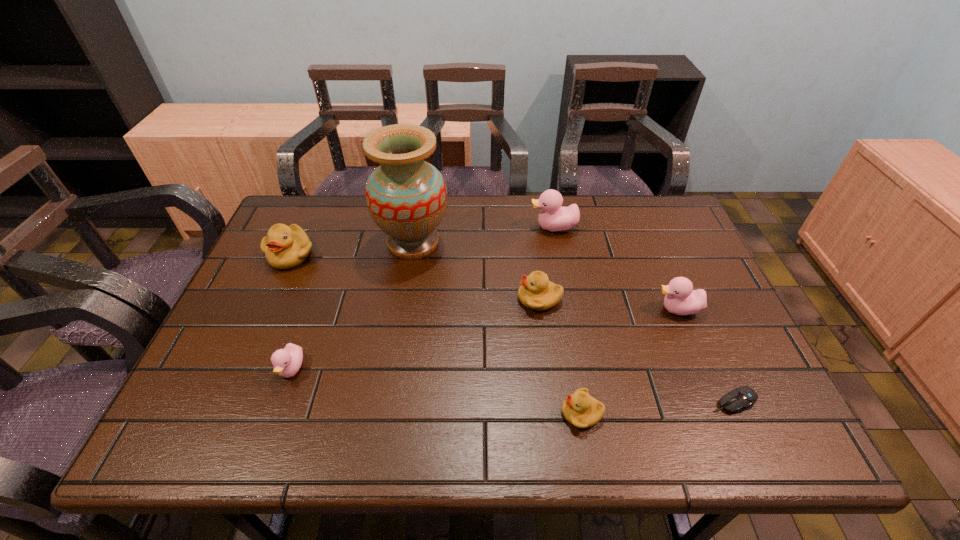
The image size is (960, 540). What are the coordinates of `vase` in the screenshot? It's located at (406, 196).

Find the location of `the sixth object from right to left`. the sixth object from right to left is located at coordinates (406, 196).

At what (x,y) coordinates should I click in order to perform the action: click on the farthest duckling. Please return your answer as a coordinate pair (x, y). The image size is (960, 540). Looking at the image, I should click on (553, 217).

Locate an element on the screen. The height and width of the screenshot is (540, 960). the biggest pink duckling is located at coordinates (553, 217).

You are a GUI agent. You are given a task and a screenshot of the screen. Output one action in this format:
    pyautogui.click(x=<x>, y=<y>)
    Task: Click on the biggest yellow duckling
    
    Given the screenshot: What is the action you would take?
    pyautogui.click(x=285, y=247)

The width and height of the screenshot is (960, 540). In order to click on the farthest yellow duckling in this screenshot , I will do pyautogui.click(x=285, y=247).

Locate an element on the screen. Image resolution: width=960 pixels, height=540 pixels. the second nearest pink duckling is located at coordinates (681, 299).

This screenshot has height=540, width=960. Identify the location of the rightmost duckling. (681, 299).

Where is `the second smallest yellow duckling`? the second smallest yellow duckling is located at coordinates (536, 292).

Where is `the third nearest object`? Image resolution: width=960 pixels, height=540 pixels. the third nearest object is located at coordinates (287, 362).